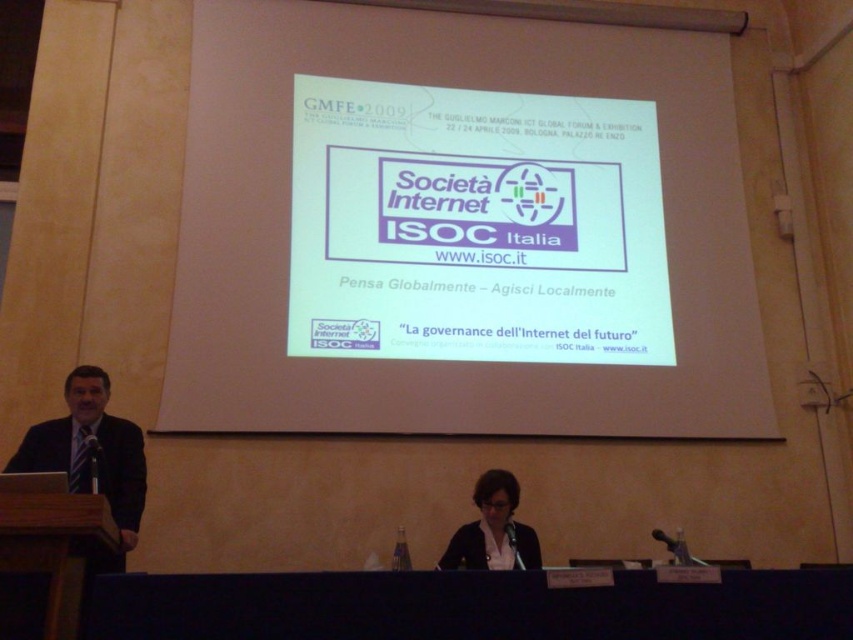
Question: Can you confirm if wooden at lower left is bigger than black matte business suit at center?

Choices:
 (A) no
 (B) yes

Answer: (B)

Question: Is dark suit at left wider than wooden at lower left?

Choices:
 (A) no
 (B) yes

Answer: (B)

Question: Estimate the real-world distances between objects in this image. Which object is closer to the white paper at upper center?

Choices:
 (A) black matte business suit at center
 (B) wooden at lower left

Answer: (A)

Question: Can you confirm if wooden at lower left is wider than matte black jacket at center?

Choices:
 (A) yes
 (B) no

Answer: (B)

Question: Considering the real-world distances, which object is farthest from the white paper at upper center?

Choices:
 (A) wooden at lower left
 (B) dark suit at left
 (C) matte black jacket at center

Answer: (A)

Question: Among these points, which one is farthest from the camera?

Choices:
 (A) (509, 541)
 (B) (271, 56)
 (C) (461, 545)

Answer: (B)